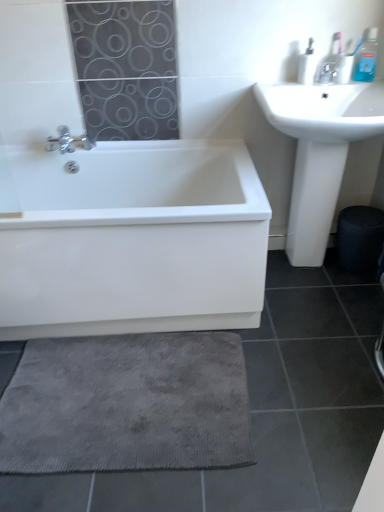
Question: Is white plastic soap dispenser at upper right, which ranks as the first toiletry in left-to-right order, spatially inside satin nickel faucet at upper right, or outside of it?

Choices:
 (A) inside
 (B) outside

Answer: (B)

Question: Does point (301, 53) appear closer or farther from the camera than point (321, 72)?

Choices:
 (A) farther
 (B) closer

Answer: (B)

Question: Which object is positioned farthest from the white plastic soap dispenser at upper right, which ranks as the first toiletry in left-to-right order?

Choices:
 (A) white glossy bathtub at lower left
 (B) gray textured bath mat at lower center
 (C) satin nickel faucet at upper right
 (D) blue plastic toothbrush at upper right, the second toiletry positioned from the left
 (E) white glossy sink at upper right

Answer: (B)

Question: Based on their relative distances, which object is nearer to the white plastic soap dispenser at upper right, which ranks as the second toiletry in right-to-left order?

Choices:
 (A) satin nickel faucet at upper right
 (B) white glossy sink at upper right
 (C) gray textured bath mat at lower center
 (D) blue plastic toothbrush at upper right, the first toiletry in the right-to-left sequence
 (E) white glossy bathtub at lower left

Answer: (A)